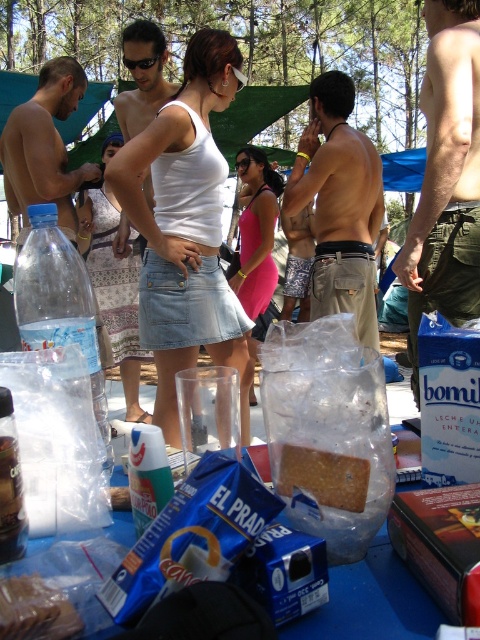
Can you confirm if blue cardboard box at center is positioned below black plastic goggles at center?

Correct, blue cardboard box at center is located below black plastic goggles at center.

Does blue cardboard box at center have a lesser width compared to black plastic goggles at center?

No, blue cardboard box at center is not thinner than black plastic goggles at center.

Find the location of a particular element. The image size is (480, 640). blue cardboard box at center is located at coordinates (372, 602).

This screenshot has width=480, height=640. Find the location of `blue cardboard box at center`. blue cardboard box at center is located at coordinates (372, 602).

Can you confirm if pink satin dress at center is positioned below clear plastic bottle at center?

Actually, pink satin dress at center is above clear plastic bottle at center.

Who is higher up, pink satin dress at center or clear plastic bottle at center?

pink satin dress at center

I want to click on pink satin dress at center, so click(255, 234).

Is point (447, 236) positioned before point (348, 618)?

No, (447, 236) is further to viewer.

Who is higher up, green canvas shorts at center or blue cardboard box at center?

green canvas shorts at center

This screenshot has width=480, height=640. What do you see at coordinates (445, 177) in the screenshot?
I see `green canvas shorts at center` at bounding box center [445, 177].

This screenshot has width=480, height=640. In order to click on green canvas shorts at center in this screenshot , I will do `click(445, 177)`.